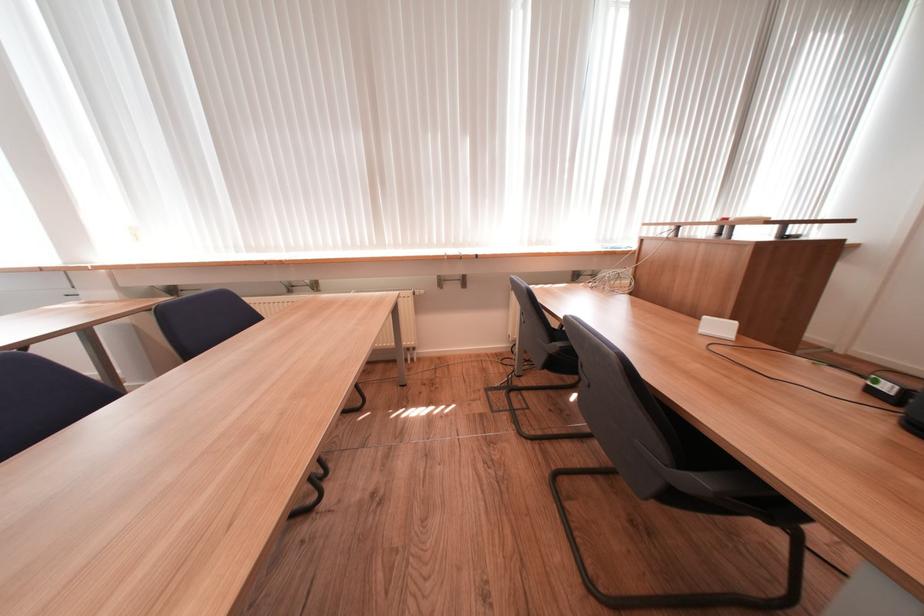
Image resolution: width=924 pixels, height=616 pixels. In order to click on white plastic object in this screenshot , I will do `click(718, 328)`.